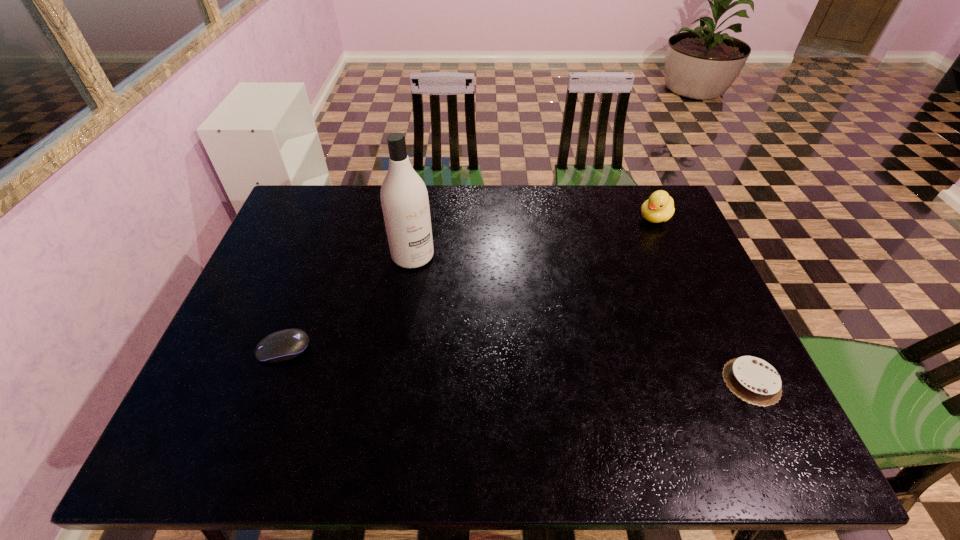
The width and height of the screenshot is (960, 540). Find the location of `vacant space on the desktop that is between the computer mouse and the chocolate cake and is positioned on the beak of the farthest object`. vacant space on the desktop that is between the computer mouse and the chocolate cake and is positioned on the beak of the farthest object is located at coordinates (486, 363).

Find the location of a particular element. This screenshot has width=960, height=540. vacant space on the desktop that is between the computer mouse and the chocolate cake and is positioned on the front-facing side of the shampoo is located at coordinates (501, 364).